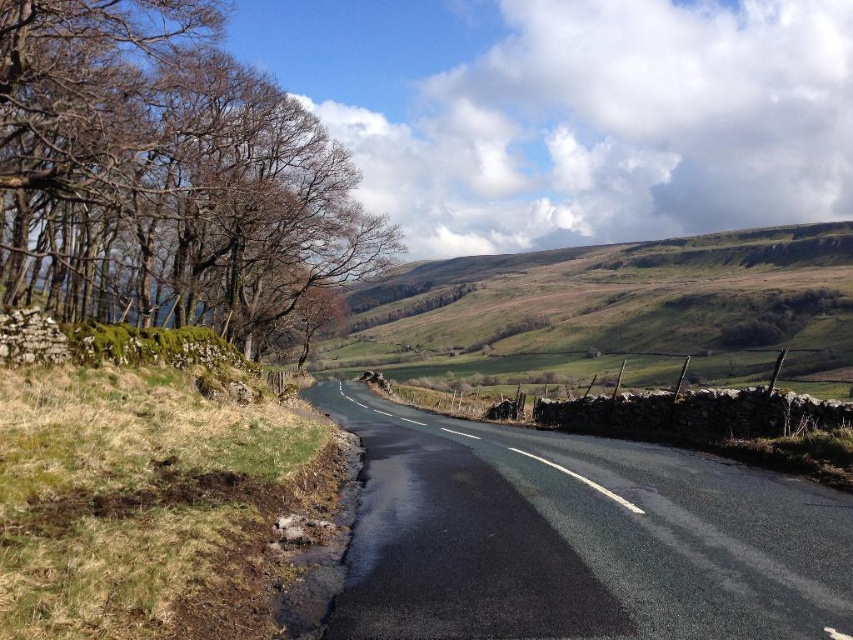
Question: Can you confirm if brown bark tree at left is thinner than black asphalt road at center?

Choices:
 (A) yes
 (B) no

Answer: (B)

Question: Which point appears closest to the camera in this image?

Choices:
 (A) (234, 234)
 (B) (807, 314)
 (C) (558, 627)

Answer: (C)

Question: Is brown bark tree at left to the left of black asphalt road at center from the viewer's perspective?

Choices:
 (A) yes
 (B) no

Answer: (A)

Question: Is black asphalt road at center positioned behind green grassy hillside at upper center?

Choices:
 (A) no
 (B) yes

Answer: (A)

Question: Which object is the closest to the black asphalt road at center?

Choices:
 (A) brown bark tree at left
 (B) green grassy hillside at upper center

Answer: (A)

Question: Which object appears closest to the camera in this image?

Choices:
 (A) brown bark tree at left
 (B) green grassy hillside at upper center

Answer: (A)